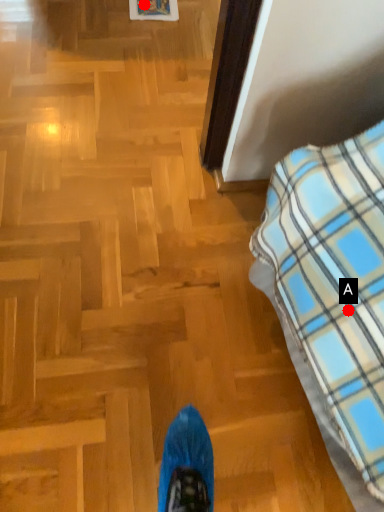
Question: Two points are circled on the image, labeled by A and B beside each circle. Which of the following is the farthest from the observer?

Choices:
 (A) A is further
 (B) B is further

Answer: (B)